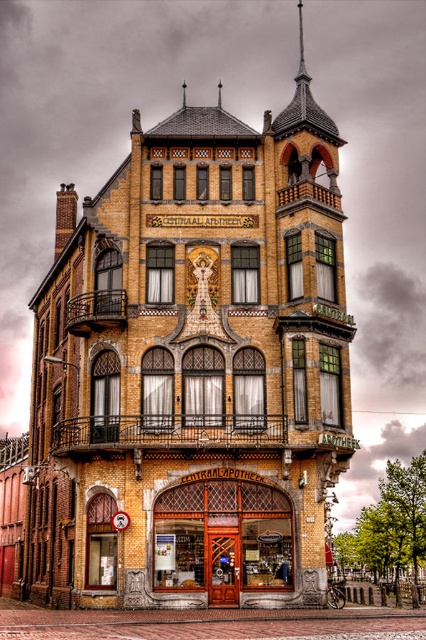
Question: Which object is closer to the camera taking this photo?

Choices:
 (A) wooden door at center
 (B) metallic clock face at center

Answer: (B)

Question: Can you confirm if wooden door at center is positioned to the left of metallic clock face at center?

Choices:
 (A) no
 (B) yes

Answer: (A)

Question: Considering the relative positions of wooden door at center and metallic clock face at center in the image provided, where is wooden door at center located with respect to metallic clock face at center?

Choices:
 (A) right
 (B) left

Answer: (A)

Question: Which object is farther from the camera taking this photo?

Choices:
 (A) metallic clock face at center
 (B) wooden door at center

Answer: (B)

Question: Observing the image, what is the correct spatial positioning of wooden door at center in reference to metallic clock face at center?

Choices:
 (A) above
 (B) below

Answer: (B)